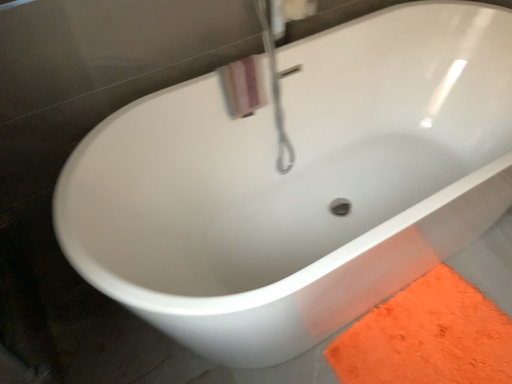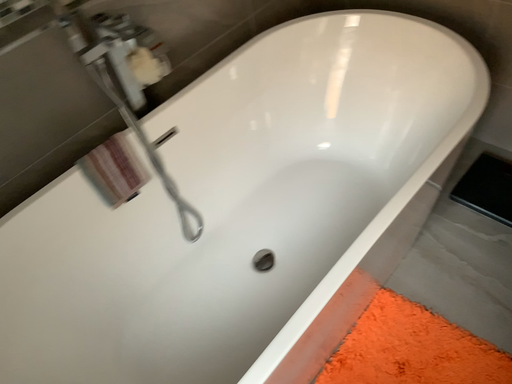
Question: Which way did the camera rotate in the video?

Choices:
 (A) rotated left
 (B) rotated right

Answer: (B)